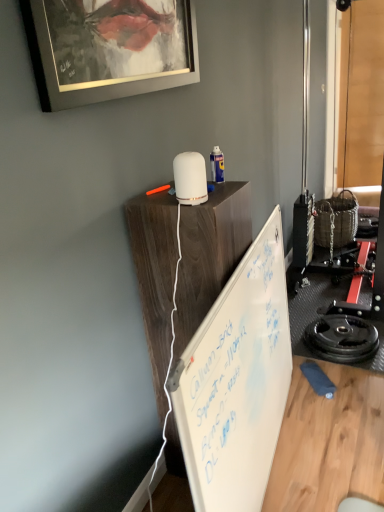
Question: Based on their sizes in the image, would you say white matte wood table at upper center is bigger or smaller than black rubber weight plate at lower right?

Choices:
 (A) small
 (B) big

Answer: (B)

Question: Does point (168, 194) appear closer or farther from the camera than point (354, 326)?

Choices:
 (A) closer
 (B) farther

Answer: (A)

Question: Which of these objects is positioned closest to the metallic silver picture frame at upper left?

Choices:
 (A) whiteboard at center
 (B) white matte diffuser at upper center
 (C) white matte wood table at upper center
 (D) black rubber weight plate at lower right

Answer: (B)

Question: Which of these objects is positioned closest to the black rubber weight plate at lower right?

Choices:
 (A) whiteboard at center
 (B) metallic silver picture frame at upper left
 (C) white matte wood table at upper center
 (D) white matte diffuser at upper center

Answer: (A)